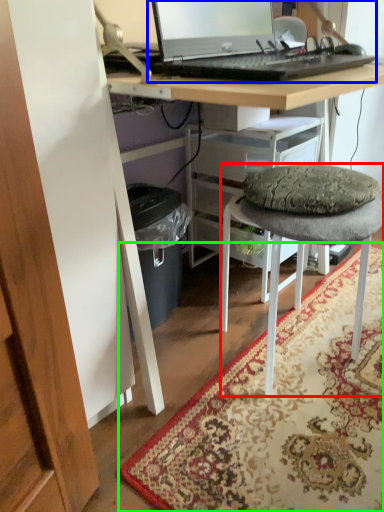
Question: Based on their relative distances, which object is nearer to stool (highlighted by a red box)? Choose from computer (highlighted by a blue box) and mat (highlighted by a green box).

Choices:
 (A) computer
 (B) mat

Answer: (B)